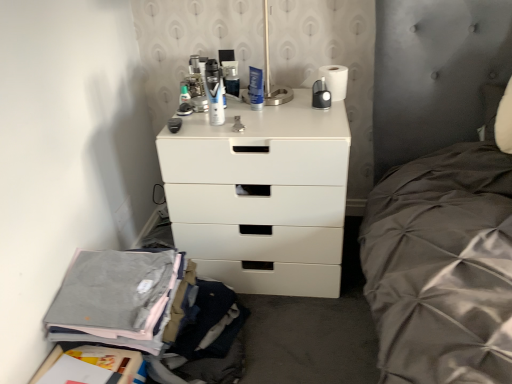
Locate an element on the screen. The height and width of the screenshot is (384, 512). vacant area that is in front of metallic silver can at center, which is the third toiletry in left-to-right order is located at coordinates (234, 112).